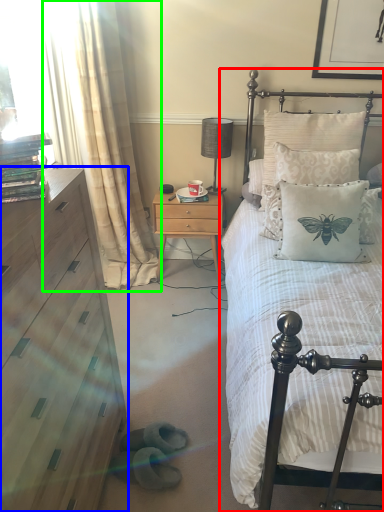
Question: Considering the real-world distances, which object is farthest from bed (highlighted by a red box)? chest of drawers (highlighted by a blue box) or curtain (highlighted by a green box)?

Choices:
 (A) chest of drawers
 (B) curtain

Answer: (B)